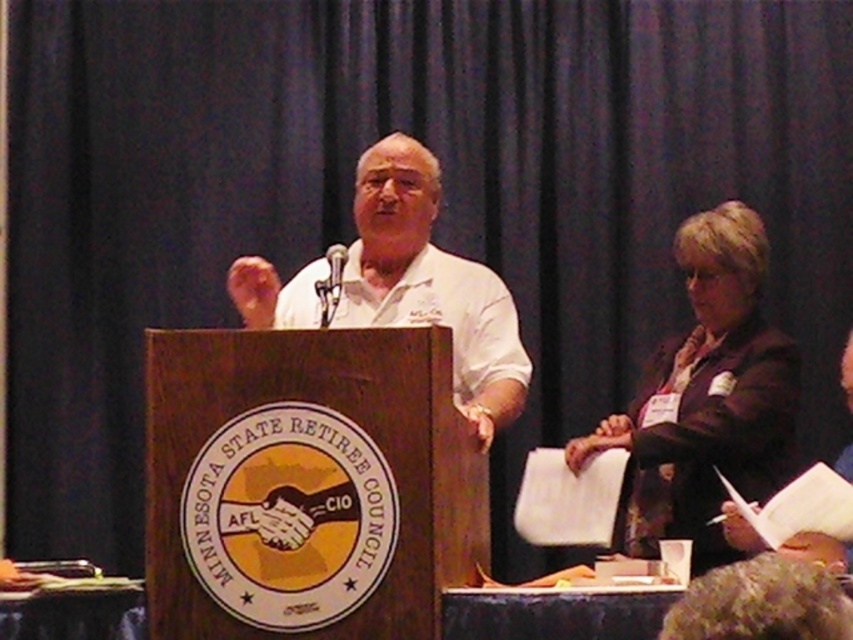
Between dark brown suit at right and white matte shirt at center, which one has more height?

Standing taller between the two is dark brown suit at right.

Can you confirm if dark brown suit at right is wider than white matte shirt at center?

Incorrect, dark brown suit at right's width does not surpass white matte shirt at center's.

Between point (721, 266) and point (434, 312), which one is positioned behind?

The point (721, 266) is behind.

You are a GUI agent. You are given a task and a screenshot of the screen. Output one action in this format:
    pyautogui.click(x=<x>, y=<y>)
    Task: Click on the dark brown suit at right
    This screenshot has width=853, height=640.
    Given the screenshot: What is the action you would take?
    (706, 397)